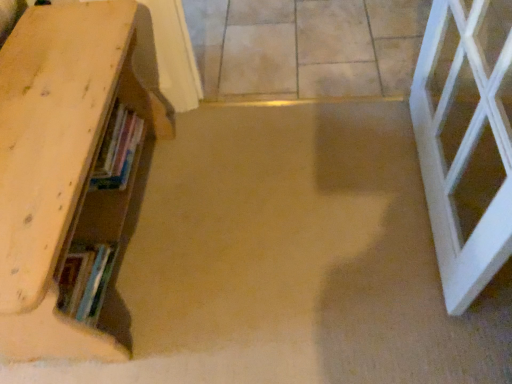
Question: In terms of size, does beige tile floor at center appear bigger or smaller than wooden bookshelf at left?

Choices:
 (A) small
 (B) big

Answer: (A)

Question: Relative to wooden bookshelf at left, is beige tile floor at center in front or behind?

Choices:
 (A) front
 (B) behind

Answer: (B)

Question: Based on their relative distances, which object is farther from the wooden bookshelf at left?

Choices:
 (A) hardcover books at left
 (B) beige tile floor at center

Answer: (B)

Question: Which is nearer to the wooden bookshelf at left?

Choices:
 (A) beige tile floor at center
 (B) hardcover books at left

Answer: (B)